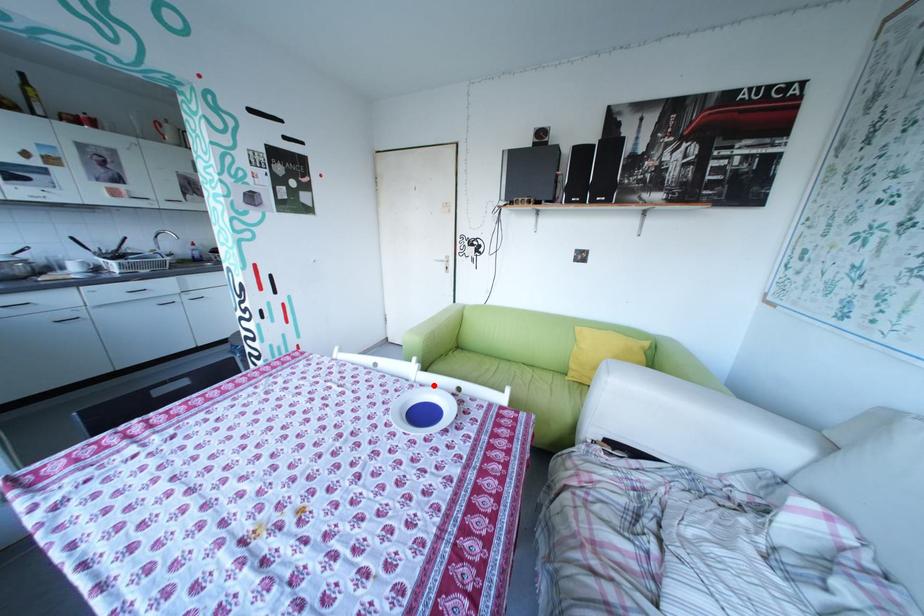
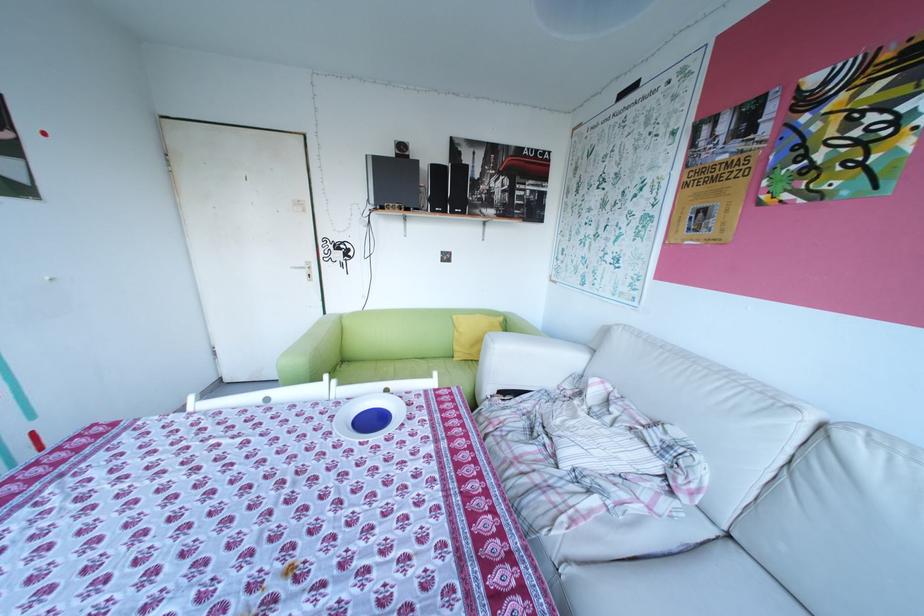
In the second image, find the point that corresponds to the highlighted location in the first image.

(360, 399)